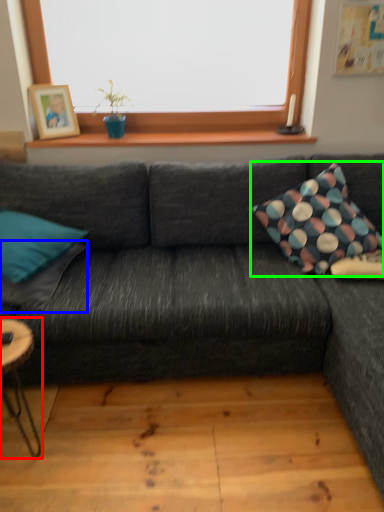
Question: Which is nearer to the coffee table (highlighted by a red box)? pillow (highlighted by a blue box) or pillow (highlighted by a green box).

Choices:
 (A) pillow
 (B) pillow

Answer: (A)